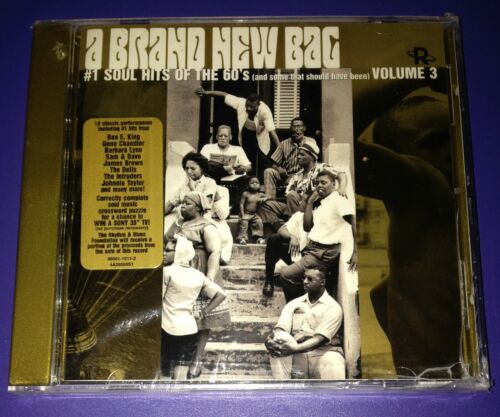
Where is `window`? window is located at coordinates (287, 98).